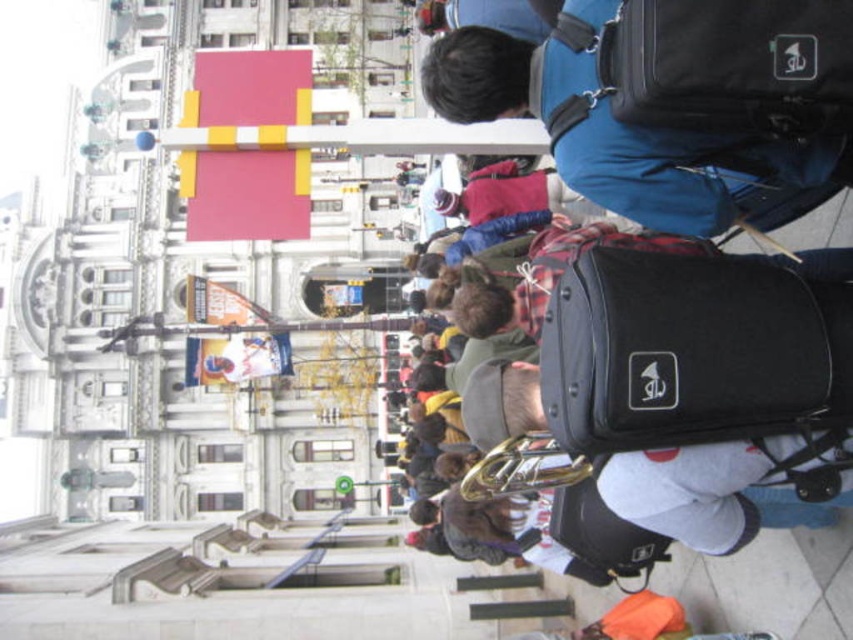
Is blue fabric backpack at upper right bigger than gold shiny trumpet at center?

Yes, blue fabric backpack at upper right is bigger than gold shiny trumpet at center.

Does blue fabric backpack at upper right have a smaller size compared to gold shiny trumpet at center?

No.

The width and height of the screenshot is (853, 640). Describe the element at coordinates (614, 129) in the screenshot. I see `blue fabric backpack at upper right` at that location.

You are a GUI agent. You are given a task and a screenshot of the screen. Output one action in this format:
    pyautogui.click(x=<x>, y=<y>)
    Task: Click on the blue fabric backpack at upper right
    This screenshot has height=640, width=853.
    Given the screenshot: What is the action you would take?
    pyautogui.click(x=614, y=129)

Which is more to the left, blue fabric backpack at upper right or black fabric suitcase at right?

Positioned to the left is blue fabric backpack at upper right.

Is point (740, 180) farther from viewer compared to point (701, 26)?

Yes, point (740, 180) is farther from viewer.

At what (x,y) coordinates should I click in order to perform the action: click on blue fabric backpack at upper right. Please return your answer as a coordinate pair (x, y). Looking at the image, I should click on (614, 129).

Is black fabric suitcase at center shorter than blue fabric backpack at upper right?

Correct, black fabric suitcase at center is not as tall as blue fabric backpack at upper right.

Between point (641, 321) and point (491, 58), which one is positioned in front?

Positioned in front is point (641, 321).

Where is `black fabric suitcase at center`? The height and width of the screenshot is (640, 853). black fabric suitcase at center is located at coordinates (695, 348).